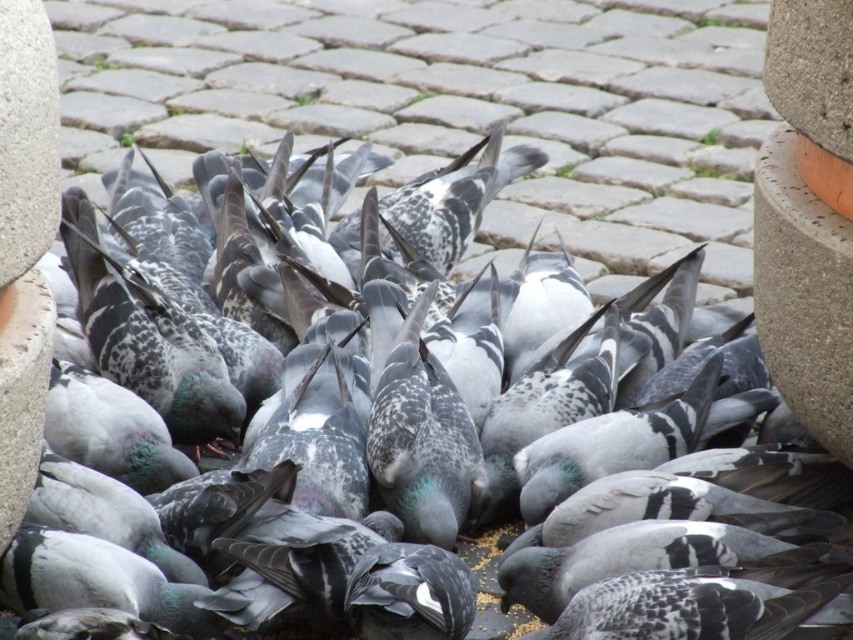
You are a delivery robot that is 1.2 meters wide. You need to move from the gray stone pavement at center to the concrete textured pillar at right. Is there enough space between them for you to pass through?

The distance between the gray stone pavement at center and the concrete textured pillar at right is 5.26 meters. Since the robot is 1.2 meters wide, there is sufficient space for it to pass through as the distance is greater than the robot width.

You are standing in a park and see the gray stone pavement at center and the concrete textured pillar at right. Which object is shorter?

The gray stone pavement at center is shorter than the concrete textured pillar at right.